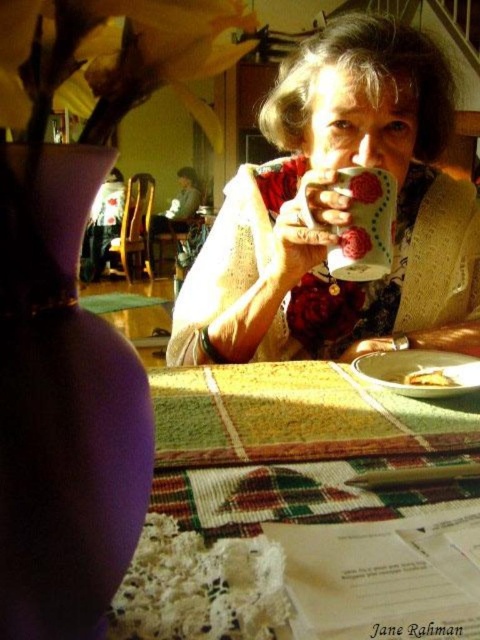
You are a customer sitting at the table and want to reach both the multicolored woven tablecloth at center and the purple matte vase at left. Which object is closer to you?

The multicolored woven tablecloth at center is closer to you because it is further to the viewer than the purple matte vase at left, meaning it occupies a more forward position in the scene.

You are a customer in the cafe and want to place your phone on the table. The phone is 15 cm long. The purple matte vase at left and the lace fabric flower at lower left are on the table. Which object is taller, and can you place your phone horizontally between them without it overlapping either?

The purple matte vase at left is much taller than the lace fabric flower at lower left. Since the phone is 15 cm long, you can place it horizontally between them as long as there is enough space between the two objects to accommodate the phone without overlapping.